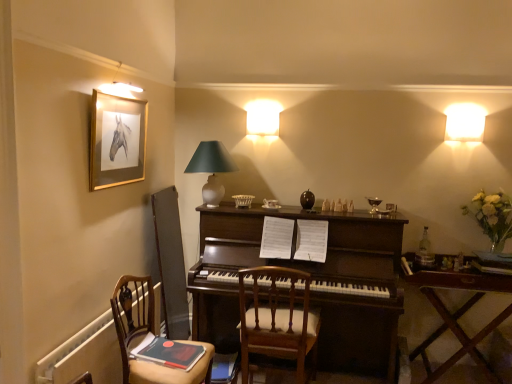
Question: Is wooden chair at lower left, acting as the 2th chair starting from the right, with matte white lampshade at center?

Choices:
 (A) yes
 (B) no

Answer: (B)

Question: Is wooden chair at lower left, acting as the 2th chair starting from the right, not within matte white lampshade at center?

Choices:
 (A) no
 (B) yes

Answer: (B)

Question: From a real-world perspective, is wooden chair at lower left, the first chair viewed from the left, beneath matte white lampshade at center?

Choices:
 (A) no
 (B) yes

Answer: (B)

Question: Considering the relative sizes of wooden chair at lower left, acting as the 2th chair starting from the right, and matte white lampshade at center in the image provided, is wooden chair at lower left, acting as the 2th chair starting from the right, taller than matte white lampshade at center?

Choices:
 (A) no
 (B) yes

Answer: (B)

Question: Is wooden chair at lower left, acting as the 2th chair starting from the right, to the left of matte white lampshade at center from the viewer's perspective?

Choices:
 (A) yes
 (B) no

Answer: (A)

Question: Is wooden chair at lower left, the first chair viewed from the left, situated inside white frosted glass lampshade at upper right or outside?

Choices:
 (A) outside
 (B) inside

Answer: (A)

Question: Looking at the image, does wooden chair at lower left, the first chair viewed from the left, seem bigger or smaller compared to white frosted glass lampshade at upper right?

Choices:
 (A) big
 (B) small

Answer: (A)

Question: Considering the positions of point coord(114,304) and point coord(479,135), is point coord(114,304) closer or farther from the camera than point coord(479,135)?

Choices:
 (A) farther
 (B) closer

Answer: (B)

Question: Is wooden chair at lower left, the first chair viewed from the left, to the left or to the right of white frosted glass lampshade at upper right in the image?

Choices:
 (A) left
 (B) right

Answer: (A)

Question: Do you think white frosted glass lampshade at upper right is within gold-framed picture at upper left, or outside of it?

Choices:
 (A) inside
 (B) outside

Answer: (B)

Question: Considering the relative positions of white frosted glass lampshade at upper right and gold-framed picture at upper left in the image provided, is white frosted glass lampshade at upper right to the left or to the right of gold-framed picture at upper left?

Choices:
 (A) left
 (B) right

Answer: (B)

Question: In terms of width, does white frosted glass lampshade at upper right look wider or thinner when compared to gold-framed picture at upper left?

Choices:
 (A) thin
 (B) wide

Answer: (B)

Question: Based on their sizes in the image, would you say white frosted glass lampshade at upper right is bigger or smaller than gold-framed picture at upper left?

Choices:
 (A) big
 (B) small

Answer: (B)

Question: Does point (202, 148) appear closer or farther from the camera than point (260, 342)?

Choices:
 (A) farther
 (B) closer

Answer: (A)

Question: Is matte white lampshade at center wider or thinner than wooden chair at center, acting as the 1th chair starting from the right?

Choices:
 (A) thin
 (B) wide

Answer: (A)